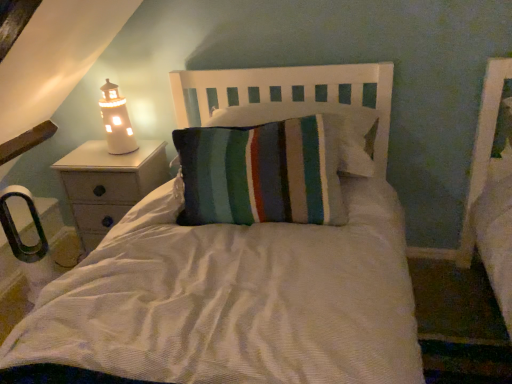
Question: From a real-world perspective, is white wood headboard at center physically above white ceramic lighthouse at left?

Choices:
 (A) yes
 (B) no

Answer: (B)

Question: Is white ceramic lighthouse at left surrounded by white wood headboard at center?

Choices:
 (A) no
 (B) yes

Answer: (A)

Question: Considering the relative positions of white wood headboard at center and white ceramic lighthouse at left in the image provided, is white wood headboard at center behind white ceramic lighthouse at left?

Choices:
 (A) yes
 (B) no

Answer: (B)

Question: From a real-world perspective, is white wood headboard at center beneath white ceramic lighthouse at left?

Choices:
 (A) yes
 (B) no

Answer: (A)

Question: Is white wood headboard at center not inside white ceramic lighthouse at left?

Choices:
 (A) yes
 (B) no

Answer: (A)

Question: Is white wood nightstand at left wider or thinner than white ceramic lighthouse at left?

Choices:
 (A) wide
 (B) thin

Answer: (A)

Question: From the image's perspective, is white wood nightstand at left positioned above or below white ceramic lighthouse at left?

Choices:
 (A) below
 (B) above

Answer: (A)

Question: In terms of height, does white wood nightstand at left look taller or shorter compared to white ceramic lighthouse at left?

Choices:
 (A) tall
 (B) short

Answer: (A)

Question: From a real-world perspective, is white wood nightstand at left physically located above or below white ceramic lighthouse at left?

Choices:
 (A) below
 (B) above

Answer: (A)

Question: Is white ceramic lighthouse at left taller or shorter than white wood nightstand at left?

Choices:
 (A) short
 (B) tall

Answer: (A)

Question: In the image, is white ceramic lighthouse at left positioned in front of or behind white wood nightstand at left?

Choices:
 (A) front
 (B) behind

Answer: (A)

Question: Is point (116, 96) closer or farther from the camera than point (109, 228)?

Choices:
 (A) closer
 (B) farther

Answer: (A)

Question: Is white ceramic lighthouse at left inside or outside of white wood nightstand at left?

Choices:
 (A) outside
 (B) inside

Answer: (A)

Question: Is white wood headboard at center wider or thinner than white wood nightstand at left?

Choices:
 (A) wide
 (B) thin

Answer: (A)

Question: Considering the positions of white wood headboard at center and white wood nightstand at left in the image, is white wood headboard at center bigger or smaller than white wood nightstand at left?

Choices:
 (A) small
 (B) big

Answer: (A)